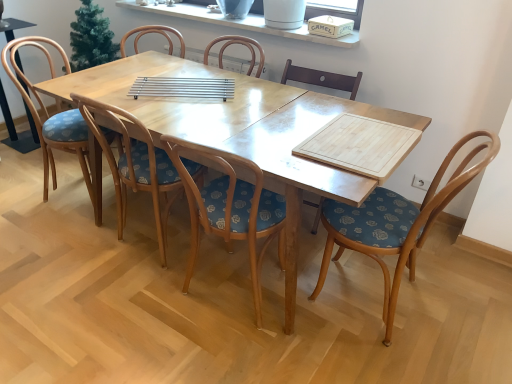
This screenshot has width=512, height=384. In order to click on vacant region under wooden chair with floral upholstery at center, the 3th chair in the left-to-right sequence (from a real-world perspective) in this screenshot , I will do `click(221, 309)`.